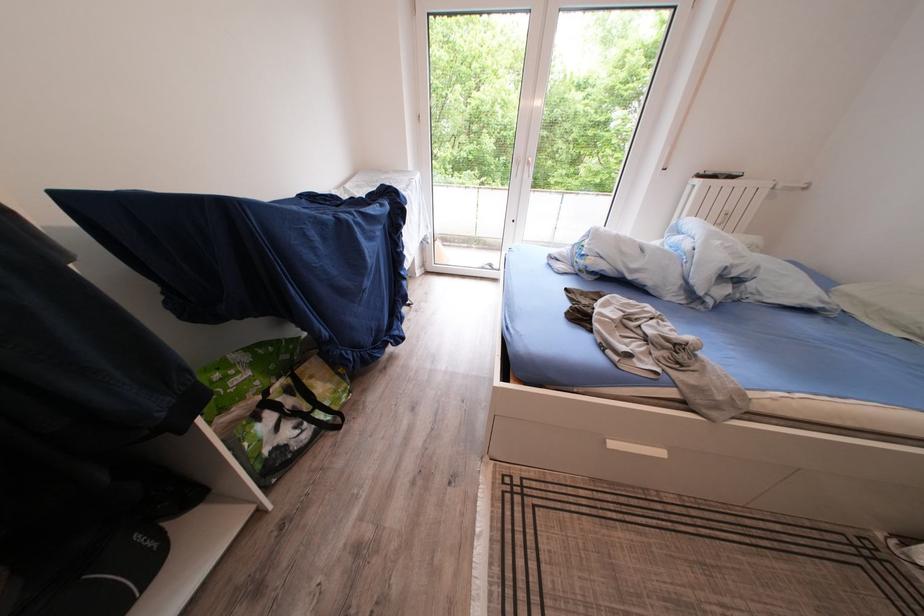
Image resolution: width=924 pixels, height=616 pixels. What are the coordinates of `black bag handle` in the screenshot? It's located at (305, 408).